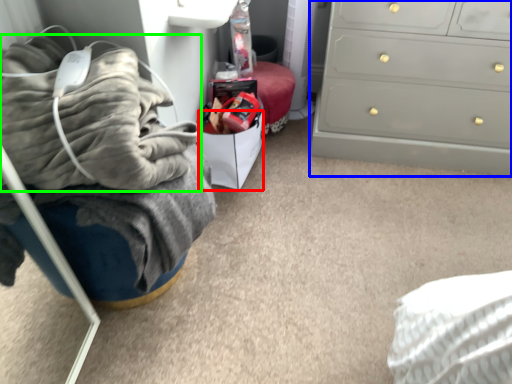
Question: Which is nearer to the drawer (highlighted by a red box)? chest of drawers (highlighted by a blue box) or blanket (highlighted by a green box).

Choices:
 (A) chest of drawers
 (B) blanket

Answer: (A)